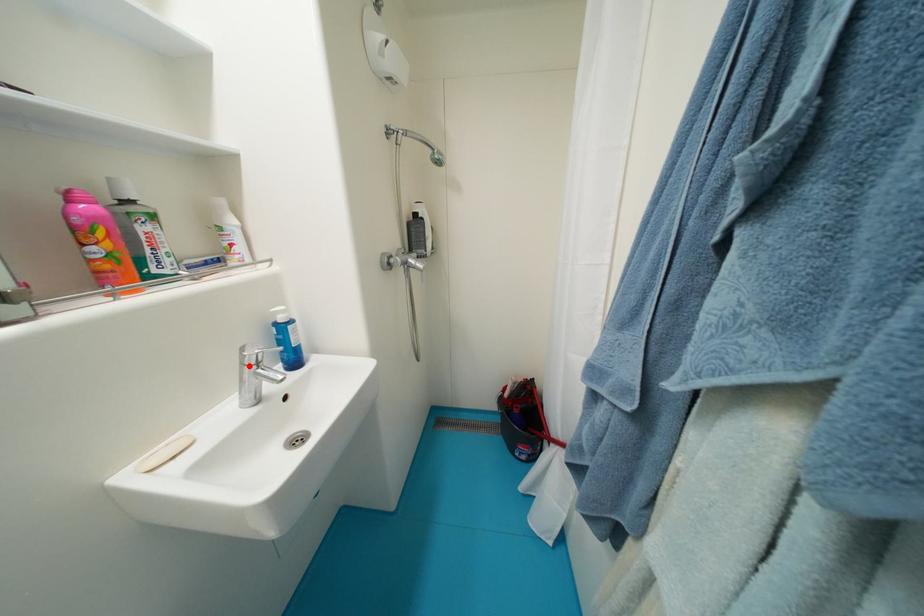
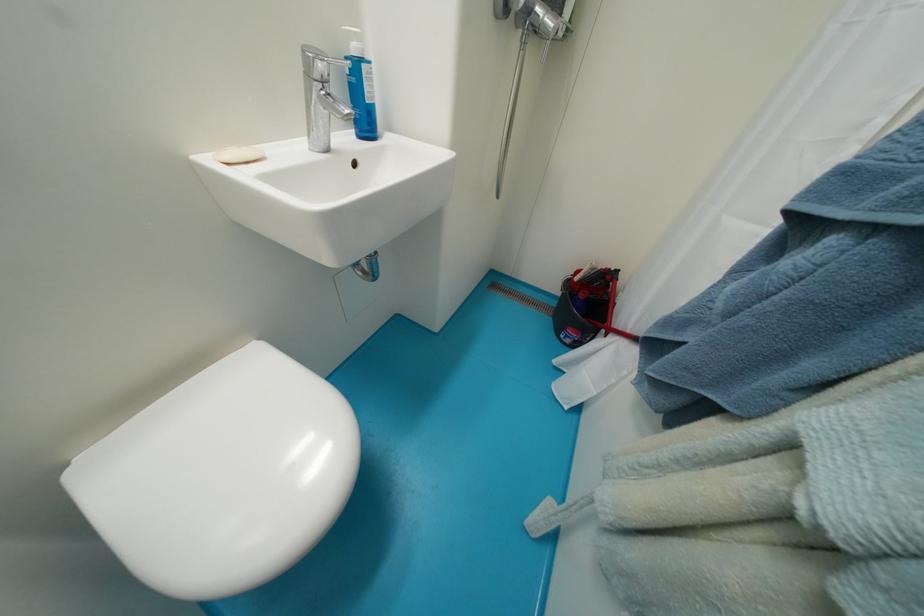
Question: I am providing you with two images of the same scene from different viewpoints. A red point is marked on the first image. Can you still see the location of the red point in image 2?

Choices:
 (A) Yes
 (B) No

Answer: (A)